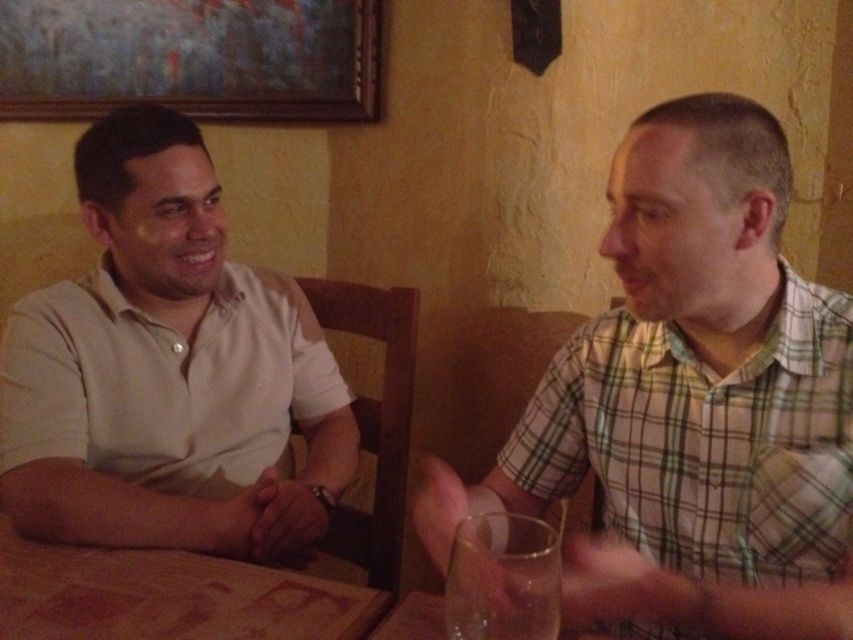
Question: Can you confirm if green plaid shirt at right is thinner than transparent glass at lower right?

Choices:
 (A) no
 (B) yes

Answer: (A)

Question: Which point is farther from the camera taking this photo?

Choices:
 (A) (602, 490)
 (B) (457, 540)
 (C) (364, 106)
 (D) (183, 360)

Answer: (C)

Question: Is green plaid shirt at right in front of matte white shirt at left?

Choices:
 (A) no
 (B) yes

Answer: (B)

Question: Which point is closer to the camera taking this photo?

Choices:
 (A) (498, 612)
 (B) (90, 100)

Answer: (A)

Question: Based on their relative distances, which object is farther from the painted wood picture frame at upper left?

Choices:
 (A) green plaid shirt at right
 (B) transparent glass at lower right

Answer: (B)

Question: Is green plaid shirt at right further to the viewer compared to painted wood picture frame at upper left?

Choices:
 (A) yes
 (B) no

Answer: (B)